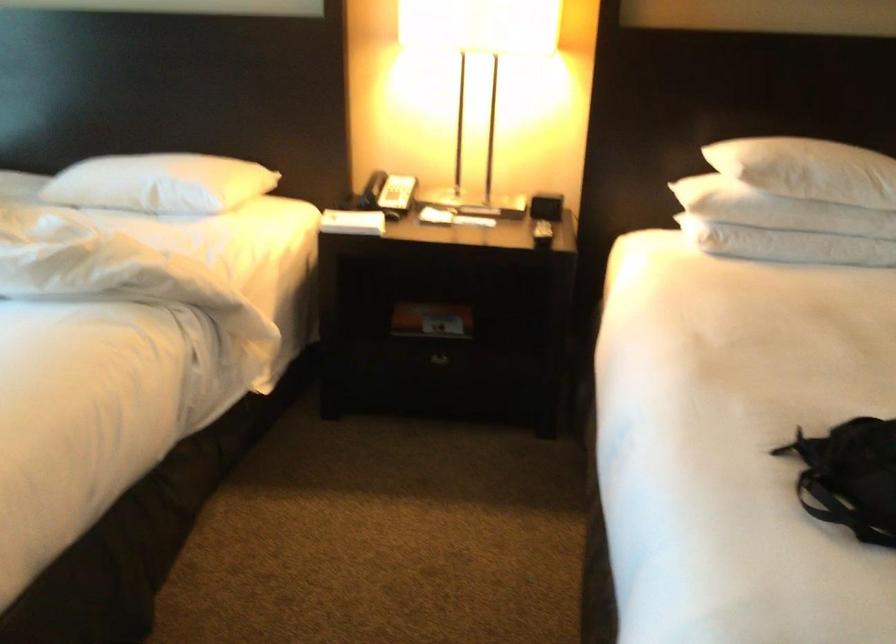
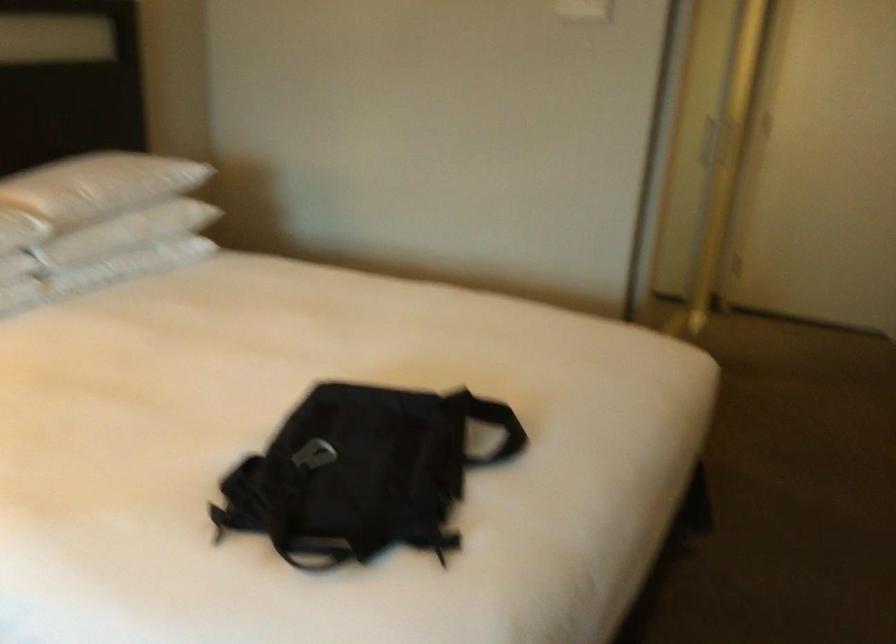
Question: Based on the continuous images, in which direction is the camera rotating? Reply with the corresponding letter.

Choices:
 (A) Left
 (B) Right
 (C) Up
 (D) Down

Answer: (B)